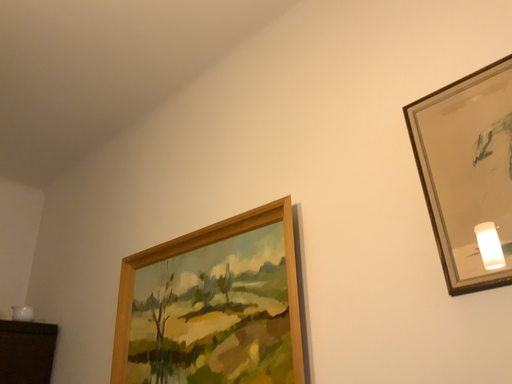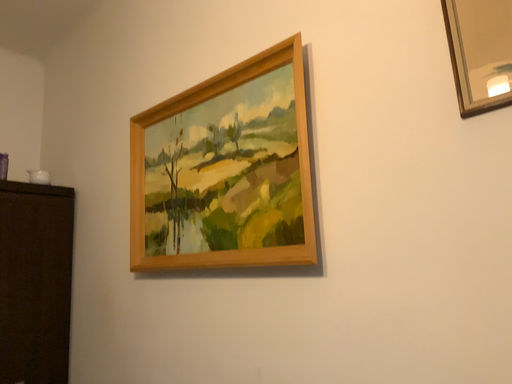
Question: Which way did the camera rotate in the video?

Choices:
 (A) rotated upward
 (B) rotated downward

Answer: (B)